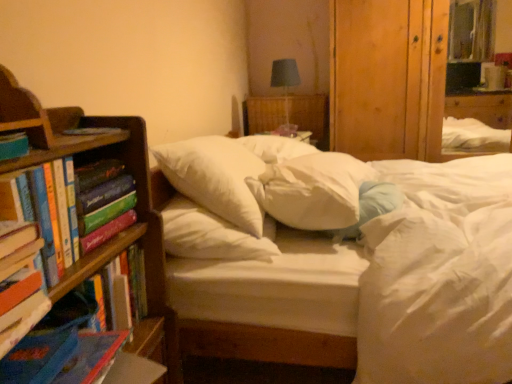
Find the location of a particular element. hardcover book at left, positioned as the first book in front-to-back order is located at coordinates (20, 283).

Find the location of a particular element. wooden table at center is located at coordinates (311, 116).

Describe the element at coordinates (13, 145) in the screenshot. I see `matte blue book at left, positioned as the 2th book in front-to-back order` at that location.

Describe the element at coordinates (272, 302) in the screenshot. The height and width of the screenshot is (384, 512). I see `white soft bed at center` at that location.

Find the location of a particular element. The height and width of the screenshot is (384, 512). white soft pillow at center, the second pillow positioned from the right is located at coordinates (313, 190).

You are a GUI agent. You are given a task and a screenshot of the screen. Output one action in this format:
    pyautogui.click(x=<x>, y=<y>)
    Task: Click on the hardcover book at left, placed as the 4th book when sorted from back to front
    The width and height of the screenshot is (512, 384).
    Given the screenshot: What is the action you would take?
    20,283

Locate an element on the screen. The width and height of the screenshot is (512, 384). bookcase above the white soft pillow at center, which ranks as the 3th pillow in left-to-right order (from a real-world perspective) is located at coordinates (137, 193).

Is wooden bookshelf at left shorter than white soft pillow at center, which ranks as the 3th pillow in left-to-right order?

No.

In the scene shown: Considering the relative positions of wooden bookshelf at left and white soft pillow at center, acting as the first pillow starting from the right, in the image provided, is wooden bookshelf at left to the right of white soft pillow at center, acting as the first pillow starting from the right, from the viewer's perspective?

No, wooden bookshelf at left is not to the right of white soft pillow at center, acting as the first pillow starting from the right.

From a real-world perspective, is wooden bookshelf at left over white soft pillow at center, acting as the first pillow starting from the right?

Yes, from a real-world perspective, wooden bookshelf at left is over white soft pillow at center, acting as the first pillow starting from the right

In terms of width, does white soft pillow at center, which ranks as the 3th pillow in left-to-right order, look wider or thinner when compared to hardcover book at left, positioned as the first book in front-to-back order?

In the image, white soft pillow at center, which ranks as the 3th pillow in left-to-right order, appears to be wider than hardcover book at left, positioned as the first book in front-to-back order.

Is white soft pillow at center, which ranks as the 3th pillow in left-to-right order, inside or outside of hardcover book at left, placed as the 4th book when sorted from back to front?

white soft pillow at center, which ranks as the 3th pillow in left-to-right order, is spatially situated outside hardcover book at left, placed as the 4th book when sorted from back to front.

From their relative heights in the image, would you say white soft pillow at center, which ranks as the 3th pillow in left-to-right order, is taller or shorter than hardcover book at left, positioned as the first book in front-to-back order?

Considering their sizes, white soft pillow at center, which ranks as the 3th pillow in left-to-right order, has more height than hardcover book at left, positioned as the first book in front-to-back order.

Who is smaller, white soft pillow at center, which ranks as the 3th pillow in left-to-right order, or hardcover book at left, positioned as the first book in front-to-back order?

With smaller size is hardcover book at left, positioned as the first book in front-to-back order.

Does hardcover book at left, marked as the 1th book in a back-to-front arrangement, have a lesser height compared to wooden bookshelf at left?

Correct, hardcover book at left, marked as the 1th book in a back-to-front arrangement, is not as tall as wooden bookshelf at left.

Between hardcover book at left, marked as the 4th book in a front-to-back arrangement, and wooden bookshelf at left, which one has larger size?

wooden bookshelf at left is bigger.

Does hardcover book at left, marked as the 4th book in a front-to-back arrangement, contain wooden bookshelf at left?

No, wooden bookshelf at left is not inside hardcover book at left, marked as the 4th book in a front-to-back arrangement.

Visually, is matte blue book at left, positioned as the 2th book in front-to-back order, positioned to the left or to the right of matte gray lampshade at upper center?

Based on their positions, matte blue book at left, positioned as the 2th book in front-to-back order, is located to the left of matte gray lampshade at upper center.

From a real-world perspective, does matte blue book at left, positioned as the 2th book in front-to-back order, sit lower than matte gray lampshade at upper center?

Incorrect, from a real-world perspective, matte blue book at left, positioned as the 2th book in front-to-back order, is higher than matte gray lampshade at upper center.

Is point (8, 159) positioned before point (285, 61)?

Yes, point (8, 159) is in front of point (285, 61).

Is matte blue book at left, which ranks as the third book in back-to-front order, completely or partially outside of matte gray lampshade at upper center?

matte blue book at left, which ranks as the third book in back-to-front order, lies outside matte gray lampshade at upper center's area.

Considering the sizes of objects matte gray lampshade at upper center and hardcover book at left, marked as the 2th book in a back-to-front arrangement, in the image provided, who is bigger, matte gray lampshade at upper center or hardcover book at left, marked as the 2th book in a back-to-front arrangement,?

matte gray lampshade at upper center is bigger.

Which is nearer, (287, 90) or (89, 188)?

Point (287, 90) is positioned farther from the camera compared to point (89, 188).

Could you measure the distance between matte gray lampshade at upper center and hardcover book at left, marked as the 2th book in a back-to-front arrangement?

matte gray lampshade at upper center is 6.24 feet away from hardcover book at left, marked as the 2th book in a back-to-front arrangement.

How different are the orientations of matte gray lampshade at upper center and hardcover book at left, marked as the 2th book in a back-to-front arrangement, in degrees?

The angle between the facing direction of matte gray lampshade at upper center and the facing direction of hardcover book at left, marked as the 2th book in a back-to-front arrangement, is 7.93 degrees.

Considering the relative sizes of white soft bed at center and white soft pillow at center, the second pillow positioned from the right, in the image provided, is white soft bed at center bigger than white soft pillow at center, the second pillow positioned from the right,?

Yes, white soft bed at center is bigger than white soft pillow at center, the second pillow positioned from the right.

Does white soft bed at center have a lesser width compared to white soft pillow at center, placed as the 2th pillow when sorted from left to right?

Incorrect, the width of white soft bed at center is not less than that of white soft pillow at center, placed as the 2th pillow when sorted from left to right.

Considering the points (183, 311) and (291, 178), which point is in front, point (183, 311) or point (291, 178)?

Positioned in front is point (183, 311).

Is white soft bed at center aimed at white soft pillow at center, the second pillow positioned from the right?

No, white soft bed at center does not turn towards white soft pillow at center, the second pillow positioned from the right.

Considering the sizes of objects wooden bookshelf at left and matte blue book at left, positioned as the 2th book in front-to-back order, in the image provided, who is bigger, wooden bookshelf at left or matte blue book at left, positioned as the 2th book in front-to-back order,?

wooden bookshelf at left.

Considering the sizes of wooden bookshelf at left and matte blue book at left, positioned as the 2th book in front-to-back order, in the image, is wooden bookshelf at left wider or thinner than matte blue book at left, positioned as the 2th book in front-to-back order,?

Clearly, wooden bookshelf at left has more width compared to matte blue book at left, positioned as the 2th book in front-to-back order.

Based on the photo, could you tell me if wooden bookshelf at left is facing matte blue book at left, which ranks as the third book in back-to-front order?

Yes, wooden bookshelf at left is facing matte blue book at left, which ranks as the third book in back-to-front order.

Considering the points (40, 123) and (14, 149), which point is in front, point (40, 123) or point (14, 149)?

The point (14, 149) is closer to the camera.

Find the location of a particular element. The image size is (512, 384). pillow that is the 1st object located above the wooden bookshelf at left (from the image's perspective) is located at coordinates (370, 207).

At what (x,y) coordinates should I click in order to perform the action: click on book that is the 2nd one when counting downward from the white soft pillow at center, acting as the first pillow starting from the right (from the image's perspective). Please return your answer as a coordinate pair (x, y). Image resolution: width=512 pixels, height=384 pixels. Looking at the image, I should click on (20, 283).

Based on their spatial positions, is white soft pillow at center, acting as the first pillow starting from the right, or hardcover book at left, marked as the 4th book in a front-to-back arrangement, further from wooden bookshelf at left?

white soft pillow at center, acting as the first pillow starting from the right, lies further to wooden bookshelf at left than the other object.

Estimate the real-world distances between objects in this image. Which object is further from white soft pillow at center, which ranks as the 3th pillow in left-to-right order, hardcover book at left, which is the 3th book from front to back, or matte blue book at left, positioned as the 2th book in front-to-back order?

matte blue book at left, positioned as the 2th book in front-to-back order.

Based on their spatial positions, is white soft pillow at center, acting as the first pillow starting from the right, or wooden wardrobe at upper right further from matte blue book at left, positioned as the 2th book in front-to-back order?

wooden wardrobe at upper right is positioned further to the anchor matte blue book at left, positioned as the 2th book in front-to-back order.

When comparing their distances from white soft pillow at center, the first pillow in the left-to-right sequence, does wooden wardrobe at upper right or hardcover book at left, marked as the 1th book in a back-to-front arrangement, seem further?

wooden wardrobe at upper right is further to white soft pillow at center, the first pillow in the left-to-right sequence.

When comparing their distances from white soft pillow at center, acting as the first pillow starting from the right, does hardcover book at left, marked as the 1th book in a back-to-front arrangement, or wooden wardrobe at upper right seem further?

Among the two, wooden wardrobe at upper right is located further to white soft pillow at center, acting as the first pillow starting from the right.

Considering their positions, is hardcover book at left, which is the 3th book from front to back, positioned closer to wooden wardrobe at upper right than matte gray lampshade at upper center?

The object closer to wooden wardrobe at upper right is matte gray lampshade at upper center.

When comparing their distances from white soft bed at center, does wooden wardrobe at upper right or hardcover book at left, which is the 3th book from front to back, seem closer?

hardcover book at left, which is the 3th book from front to back, lies closer to white soft bed at center than the other object.

Which object lies nearer to the anchor point matte gray lampshade at upper center, hardcover book at left, marked as the 4th book in a front-to-back arrangement, or wooden bookshelf at left?

wooden bookshelf at left lies closer to matte gray lampshade at upper center than the other object.

The image size is (512, 384). I want to click on bed located between matte blue book at left, positioned as the 2th book in front-to-back order, and wooden wardrobe at upper right in the depth direction, so click(x=272, y=302).

At what (x,y) coordinates should I click in order to perform the action: click on armoire positioned between hardcover book at left, marked as the 2th book in a back-to-front arrangement, and matte gray lampshade at upper center from near to far. Please return your answer as a coordinate pair (x, y). The width and height of the screenshot is (512, 384). Looking at the image, I should click on (388, 78).

You are a GUI agent. You are given a task and a screenshot of the screen. Output one action in this format:
    pyautogui.click(x=<x>, y=<y>)
    Task: Click on the bed positioned between hardcover book at left, marked as the 2th book in a back-to-front arrangement, and wooden wardrobe at upper right from near to far
    The height and width of the screenshot is (384, 512).
    Given the screenshot: What is the action you would take?
    pyautogui.click(x=272, y=302)

This screenshot has width=512, height=384. In order to click on armoire between wooden bookshelf at left and matte gray lampshade at upper center along the z-axis in this screenshot , I will do `click(388, 78)`.